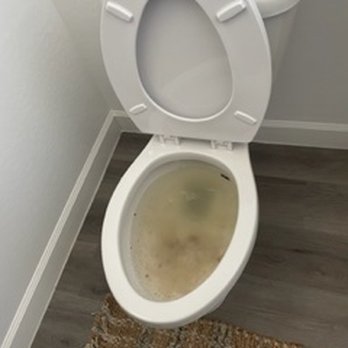
Find the location of a particular element. This screenshot has height=348, width=348. white floor trim is located at coordinates (43, 297), (277, 134), (111, 137).